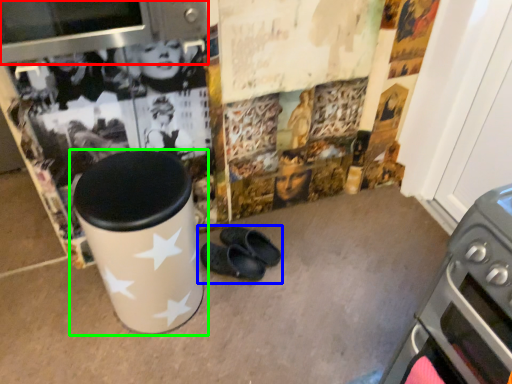
Question: Which is nearer to the appliance (highlighted by a red box)? footwear (highlighted by a blue box) or waste container (highlighted by a green box).

Choices:
 (A) footwear
 (B) waste container

Answer: (B)